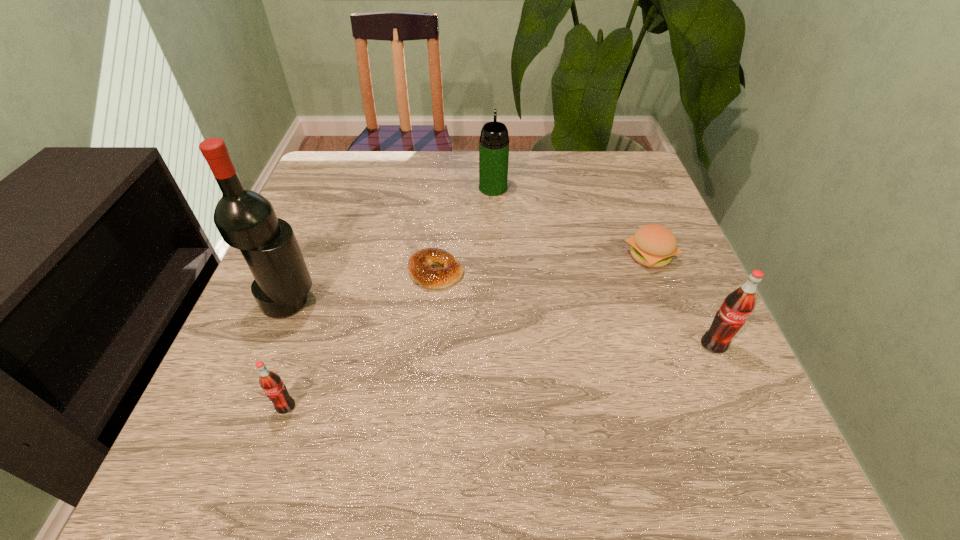
You are a GUI agent. You are given a task and a screenshot of the screen. Output one action in this format:
    pyautogui.click(x=<x>, y=<y>)
    Task: Click on the vacant area situated on the label of the second nearest object
    
    Given the screenshot: What is the action you would take?
    pyautogui.click(x=729, y=379)

Identify the location of vacant area located from the spout of the fourth object from left to right. point(492,166).

Where is `vacant space located 0.120m from the spout of the fourth object from left to right`? The width and height of the screenshot is (960, 540). vacant space located 0.120m from the spout of the fourth object from left to right is located at coordinates (492, 157).

I want to click on free space located 0.130m from the spout of the fourth object from left to right, so click(x=492, y=155).

This screenshot has width=960, height=540. I want to click on vacant space located 0.140m on the front of the wine bottle, so click(x=258, y=382).

At what (x,y) coordinates should I click in order to perform the action: click on vacant space located 0.100m on the front of the hamburger. Please return your answer as a coordinate pair (x, y). Image resolution: width=960 pixels, height=540 pixels. Looking at the image, I should click on (670, 310).

Where is `blank space located on the left of the bagel`? This screenshot has width=960, height=540. blank space located on the left of the bagel is located at coordinates (376, 272).

Where is `object present at the far edge`? This screenshot has height=540, width=960. object present at the far edge is located at coordinates (494, 141).

The height and width of the screenshot is (540, 960). What are the coordinates of `object present at the near edge` in the screenshot? It's located at (271, 383).

Find the location of a particular element. The width and height of the screenshot is (960, 540). soda bottle located at the left edge is located at coordinates (271, 383).